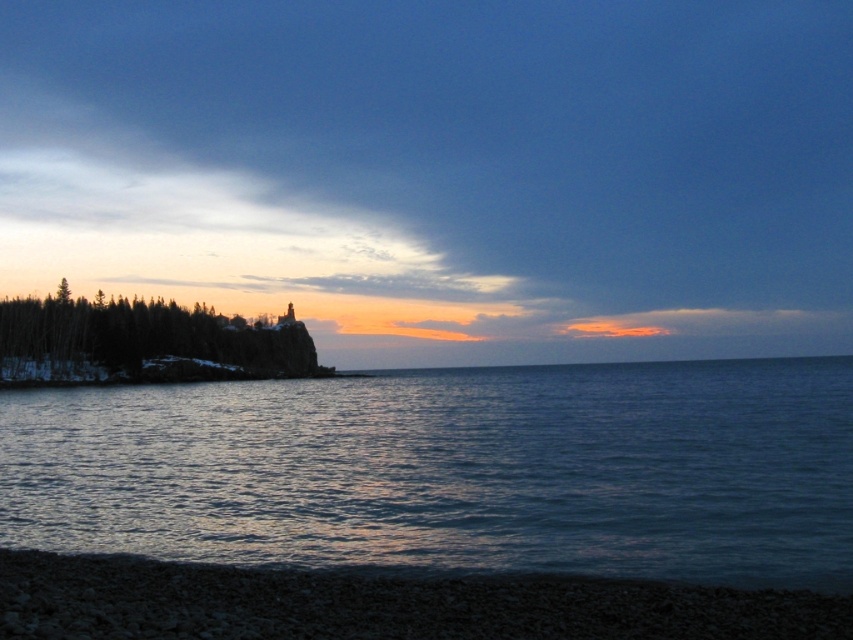
Is blue water at center wider than green matte trees at left?

Yes, blue water at center is wider than green matte trees at left.

You are a GUI agent. You are given a task and a screenshot of the screen. Output one action in this format:
    pyautogui.click(x=<x>, y=<y>)
    Task: Click on the blue water at center
    The height and width of the screenshot is (640, 853).
    Given the screenshot: What is the action you would take?
    pyautogui.click(x=451, y=470)